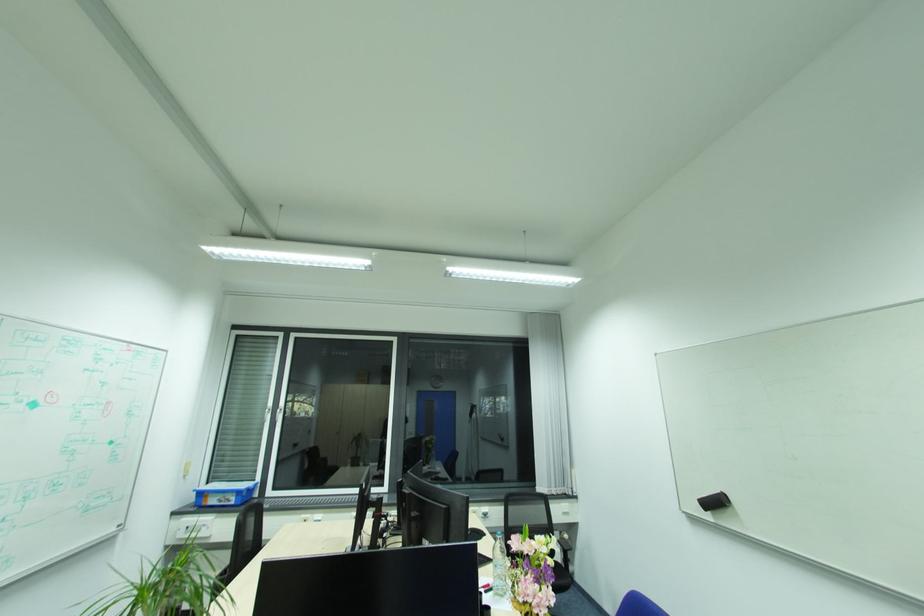
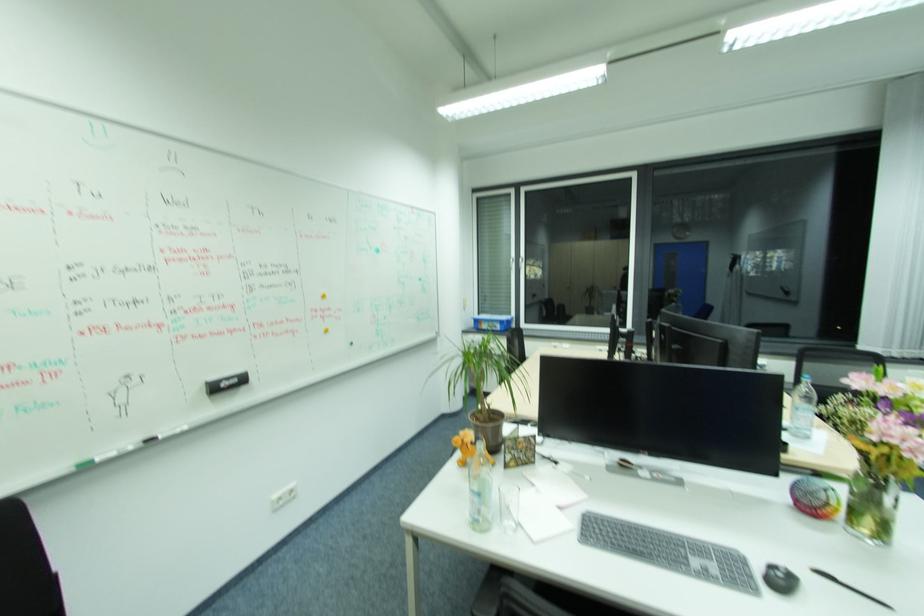
Locate, in the second image, the point that corresponds to the point at 235,500 in the first image.

(502, 326)